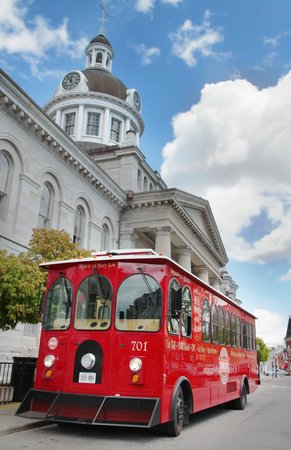
Locate an element on the screen. Image resolution: width=291 pixels, height=450 pixels. support columns is located at coordinates (162, 244), (184, 259), (203, 274), (215, 286).